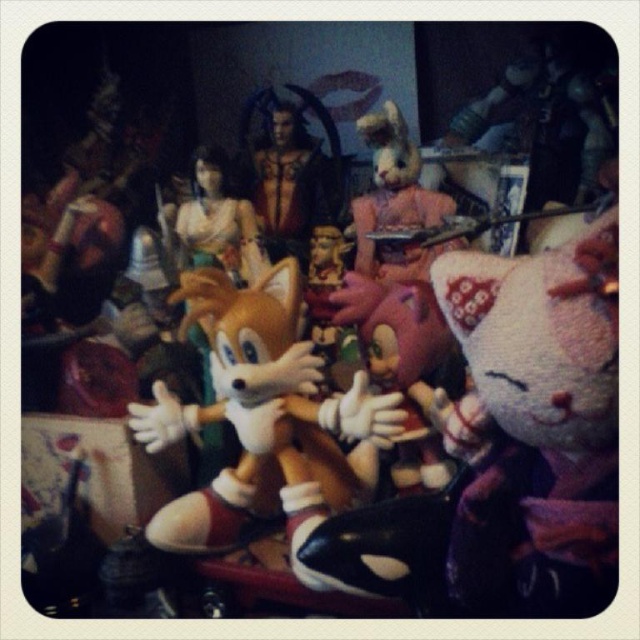
Who is more forward, (x=164, y=396) or (x=374, y=252)?

Point (x=164, y=396) is more forward.

Is point (253, 401) farther from camera compared to point (406, 161)?

No.

This screenshot has height=640, width=640. In order to click on fluffy orange fox at center in this screenshot , I will do `click(260, 413)`.